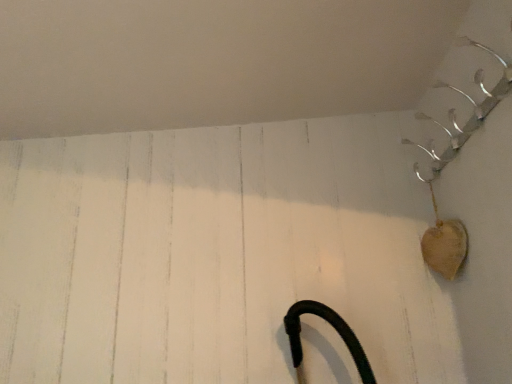
The width and height of the screenshot is (512, 384). I want to click on silver metallic hook at upper right, so click(x=470, y=116).

Measure the distance between silver metallic hook at upper right and camera.

silver metallic hook at upper right is 1.01 meters from camera.

What do you see at coordinates (470, 116) in the screenshot?
I see `silver metallic hook at upper right` at bounding box center [470, 116].

The height and width of the screenshot is (384, 512). What are the coordinates of `silver metallic hook at upper right` in the screenshot? It's located at point(470,116).